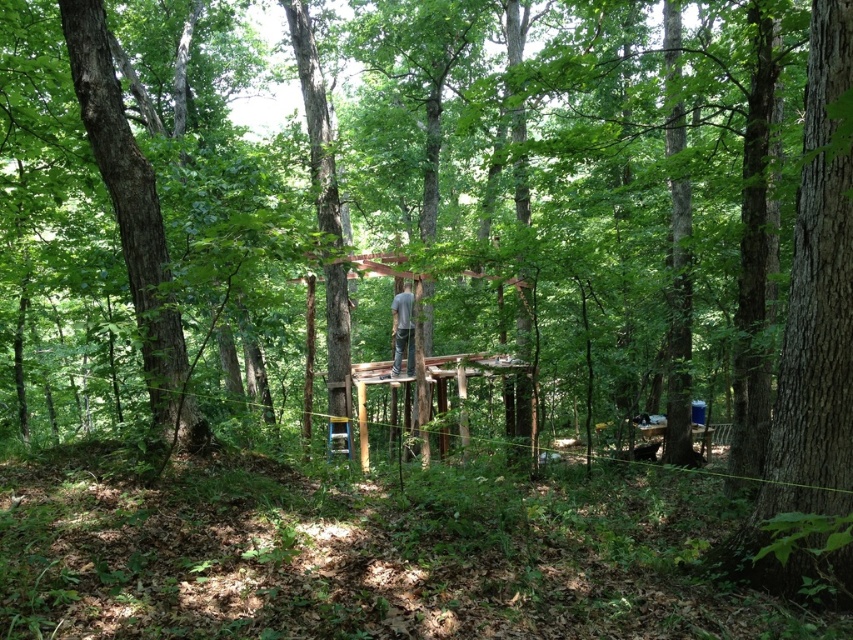
You are standing at the center of the wooded area and want to locate the smooth brown tree trunk at left. According to the coordinates provided, in which direction should you look to find it?

The smooth brown tree trunk at left is located at point (132, 225), which means it is to the left of your current position at the center. You should look to your left to find it.

You are a hiker who wants to estimate the relative sizes of objects in the forest. Which object is wider, the smooth brown tree trunk at left or the gray fabric shirt at center?

The smooth brown tree trunk at left is wider than the gray fabric shirt at center according to the description.